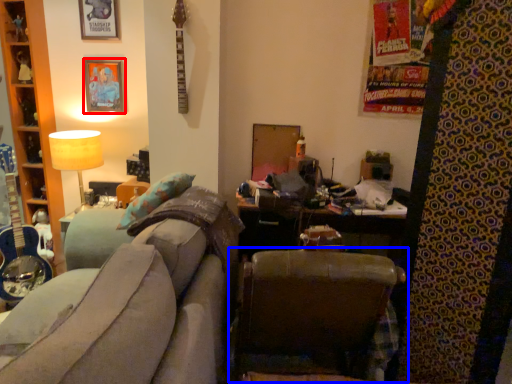
Question: Which of the following is the closest to the observer, picture frame (highlighted by a red box) or chair (highlighted by a blue box)?

Choices:
 (A) picture frame
 (B) chair

Answer: (B)